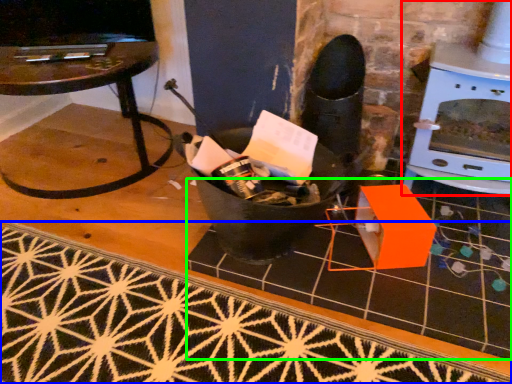
Question: Considering the real-world distances, which object is closest to fireplace (highlighted by a red box)? doormat (highlighted by a blue box) or tile (highlighted by a green box).

Choices:
 (A) doormat
 (B) tile

Answer: (B)